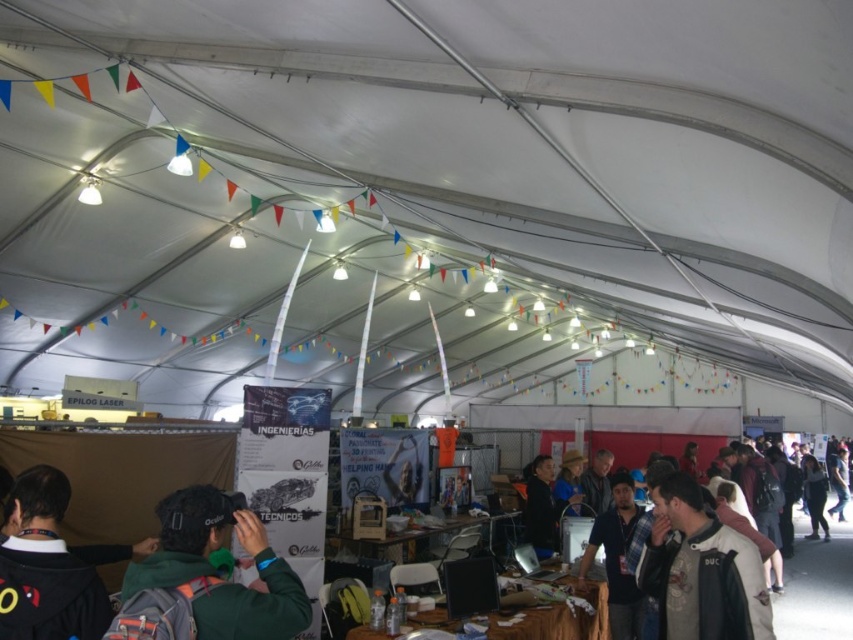
You are attending an event under a large white tent and notice two items of interest. You see a dark blue jacket at lower right and a wooden table at center. Which item is larger in size?

The dark blue jacket at lower right is bigger than the wooden table at center.

You are at the event and want to grab the dark blue jacket at lower right from the wooden table at center. Can you reach it without moving from your current position?

The dark blue jacket at lower right is to the right of the wooden table at center, so you can reach it without moving from your current position if you can extend your arm to the right side of the table.

You are attending an event under a large white tent with several booths. You notice a dark green hoodie at lower left and a dark blue jacket at lower right. Which clothing item is located more to the left side of the tent?

A: The dark green hoodie at lower left is positioned on the left side of the dark blue jacket at lower right, so the dark green hoodie at lower left is more to the left side of the tent.